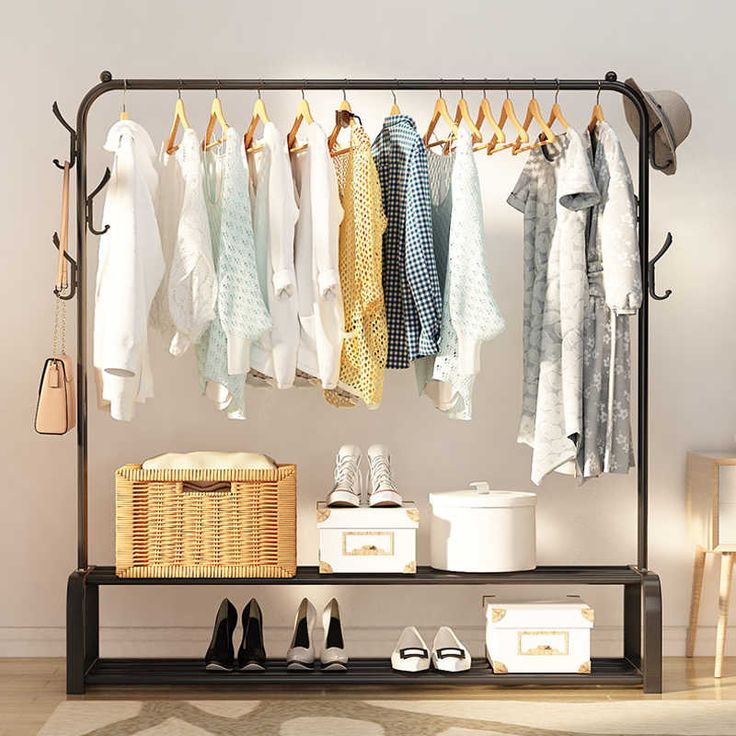
Image resolution: width=736 pixels, height=736 pixels. I want to click on shoe rack rungs, so click(x=120, y=679), click(x=141, y=670), click(x=118, y=662), click(x=166, y=659).